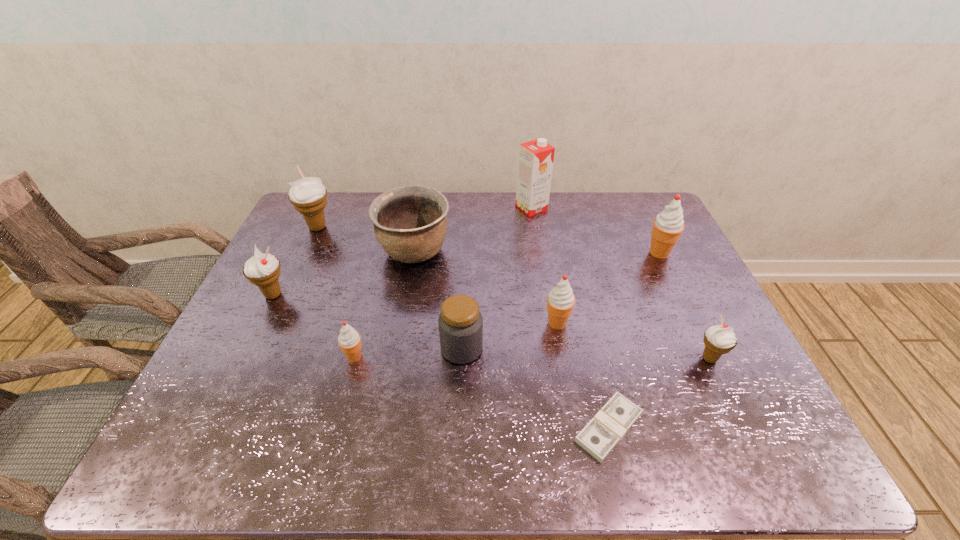
This screenshot has width=960, height=540. In order to click on the second smallest red icecream in this screenshot , I will do `click(560, 301)`.

Where is `gray jar`? This screenshot has height=540, width=960. gray jar is located at coordinates (460, 323).

This screenshot has width=960, height=540. In order to click on the nearest red icecream in this screenshot , I will do `click(349, 340)`.

Identify the location of the third icecream from left to right. This screenshot has height=540, width=960. (349, 340).

Where is `the smallest white icecream`? Image resolution: width=960 pixels, height=540 pixels. the smallest white icecream is located at coordinates pyautogui.click(x=720, y=339).

Find the location of a particular element. the nearest white icecream is located at coordinates (720, 339).

Where is `dollar`? The width and height of the screenshot is (960, 540). dollar is located at coordinates (611, 423).

I want to click on the shortest object, so click(611, 423).

Image resolution: width=960 pixels, height=540 pixels. Identify the location of vacant space situated on the front of the carton. (543, 281).

Identify the location of blank space located on the front of the biggest white icecream. The height and width of the screenshot is (540, 960). (276, 317).